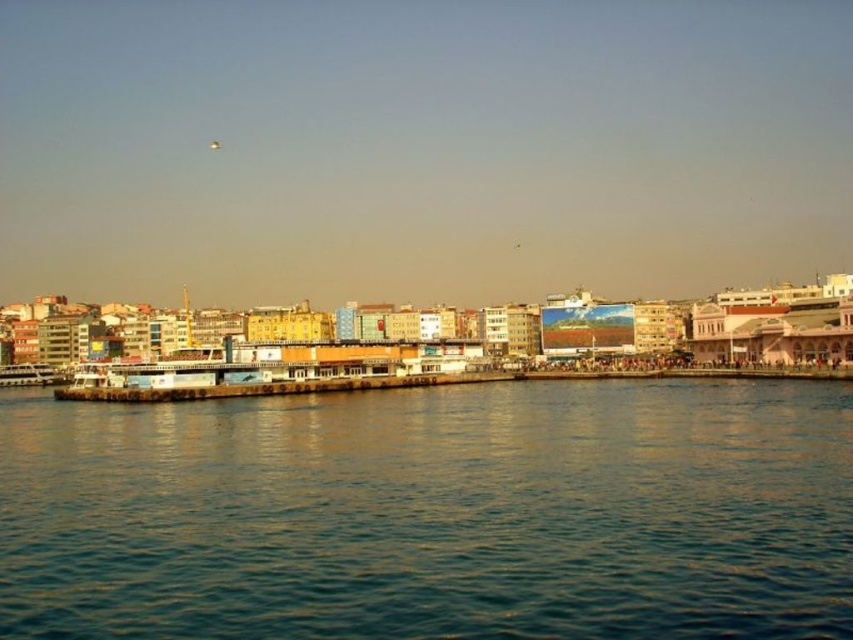
You are standing on the pier and want to take a photo of the blue water at lower center and the white matte boat at lower left. Which object is wider in the scene?

The blue water at lower center might be wider than white matte boat at lower left.

You are standing on the pier and see the blue water at lower center and the white matte boat at lower left. Which one appears taller from your viewpoint?

Answer: The blue water at lower center appears taller than the white matte boat at lower left because the description states that the blue water at lower center is much taller as white matte boat at lower left.

You are a photographer planning to capture the waterfront scene. You want to ensure that both the blue water at lower center and the white matte boat at lower left are clearly visible in your shot. Considering their sizes, which object should you focus on to ensure both are in frame?

The blue water at lower center has a larger size compared to the white matte boat at lower left. To ensure both are in frame, focus on the blue water at lower center since it occupies more space, allowing the smaller boat to remain visible within the composition.